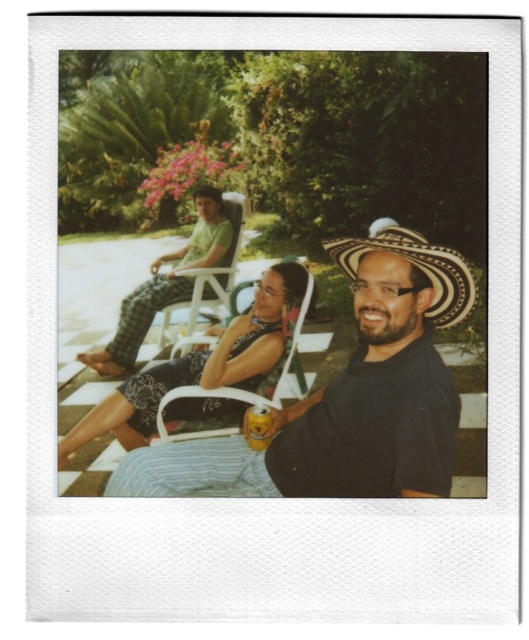
You are standing 5 feet away from the camera. You want to hand a drink to the person wearing the black matte shirt at center. Can you reach them without moving?

The black matte shirt at center is 4.00 feet from the camera. Since you are standing 5 feet away from the camera, you are 1 foot further than the target person. Therefore, you cannot reach them without moving closer.

What is located at the point with coordinates (x=166, y=284)?

The green plaid pants at upper left are located at the point with coordinates (x=166, y=284).